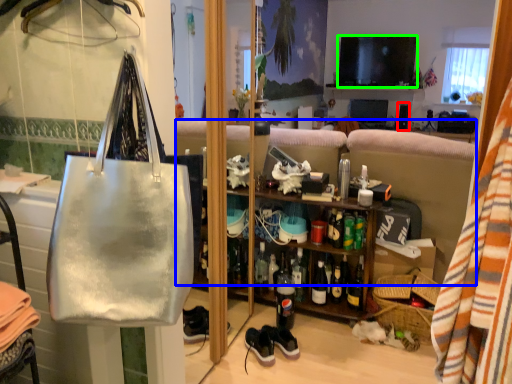
Question: Which object is the farthest from loudspeaker (highlighted by a red box)? Choose among these: studio couch (highlighted by a blue box) or television (highlighted by a green box).

Choices:
 (A) studio couch
 (B) television

Answer: (A)